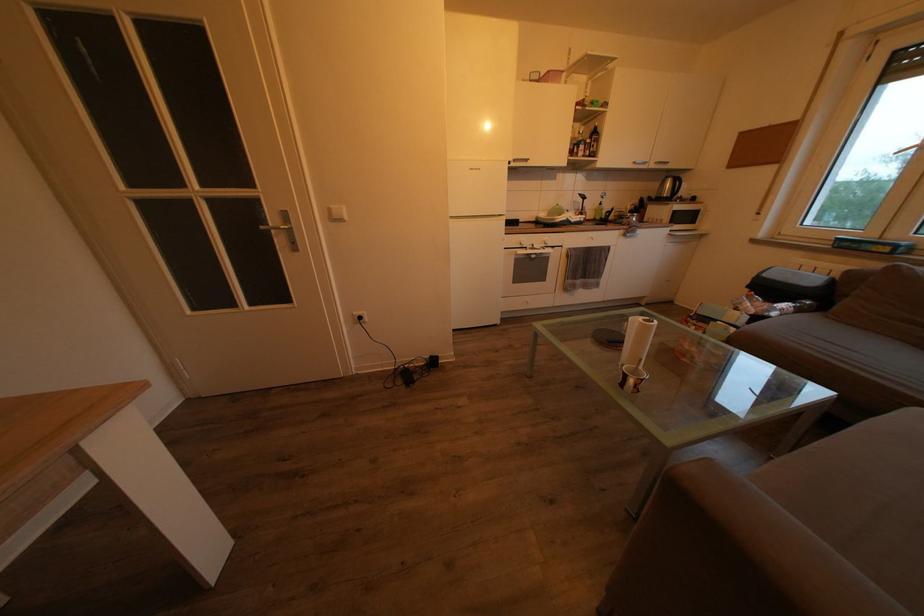
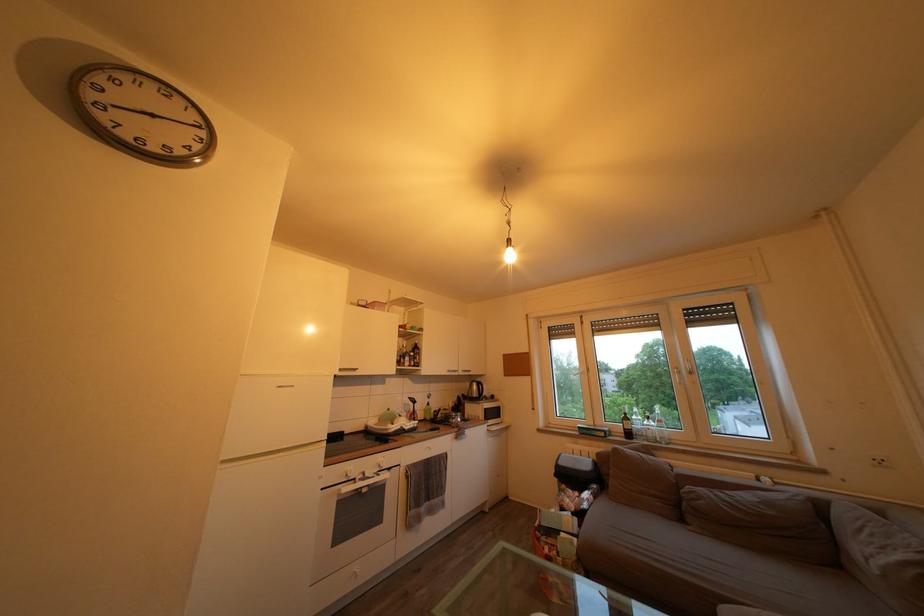
Locate, in the second image, the point that corresponds to point (543, 253) in the first image.

(375, 480)